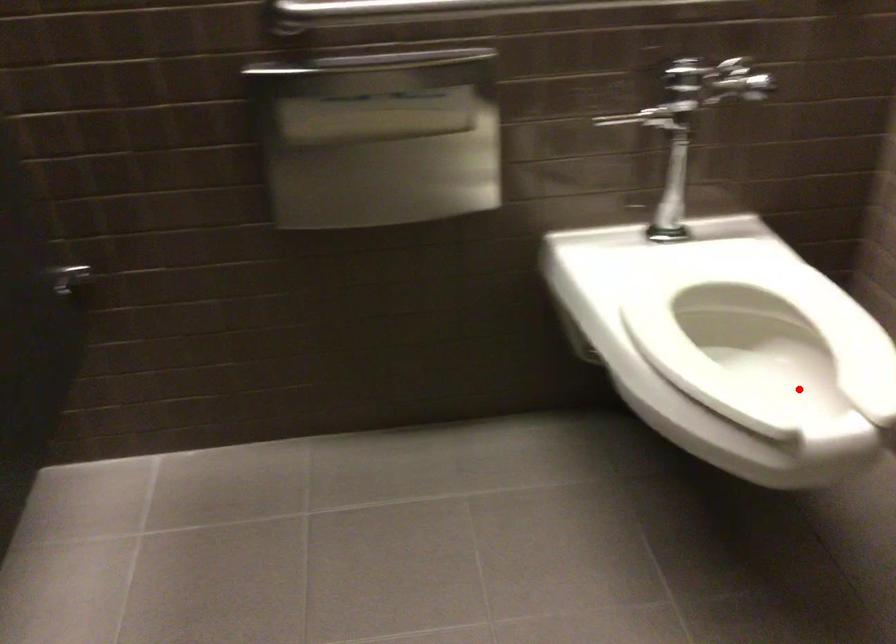
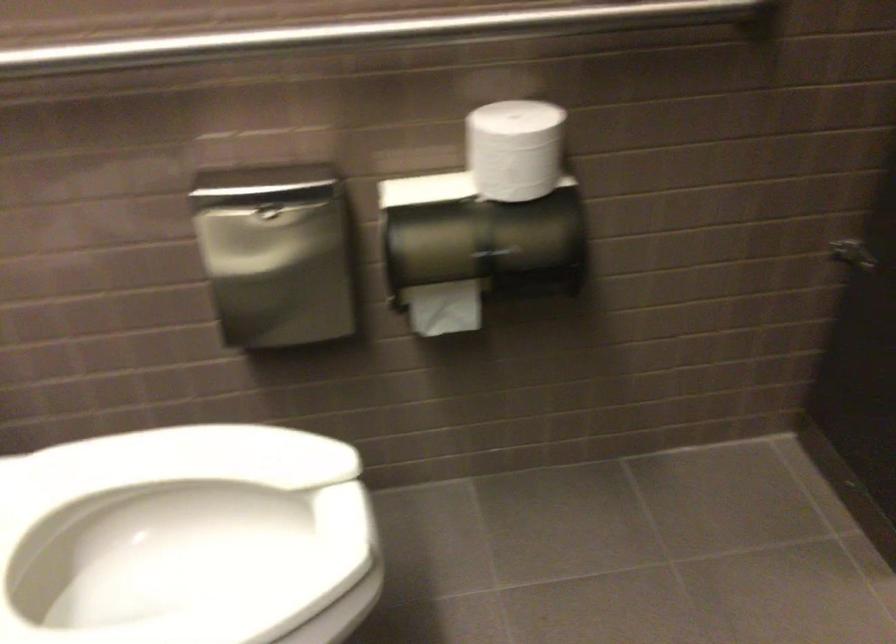
Question: I am providing you with two images of the same scene from different viewpoints. A red point is shown in image1. For the corresponding object point in image2, is it positioned nearer or farther from the camera?

Choices:
 (A) Nearer
 (B) Farther

Answer: (A)